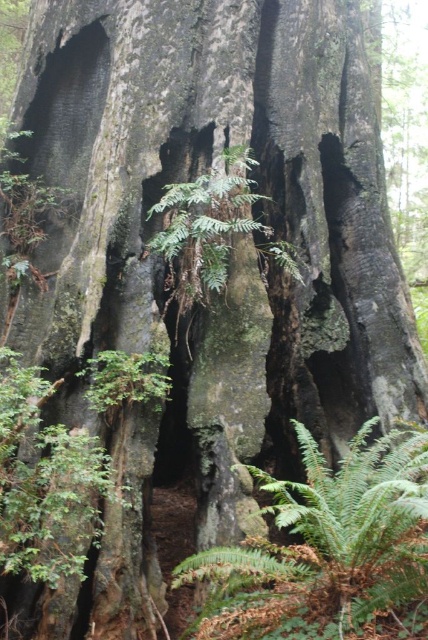
Is green fuzzy fern at center wider than green rough textured fern at center?

Yes, green fuzzy fern at center is wider than green rough textured fern at center.

The height and width of the screenshot is (640, 428). I want to click on green fuzzy fern at center, so click(326, 541).

The width and height of the screenshot is (428, 640). I want to click on green fuzzy fern at center, so click(x=326, y=541).

Can you confirm if green fuzzy fern at center is thinner than green rough fern at lower left?

In fact, green fuzzy fern at center might be wider than green rough fern at lower left.

Looking at this image, who is more forward, (229, 563) or (38, 496)?

Point (38, 496) is in front.

Who is more forward, [279,547] or [58,432]?

Positioned in front is point [279,547].

I want to click on green fuzzy fern at center, so click(326, 541).

Which is above, green rough fern at lower left or green rough textured fern at center?

green rough textured fern at center is above.

Where is `green rough fern at lower left`? green rough fern at lower left is located at coordinates (45, 481).